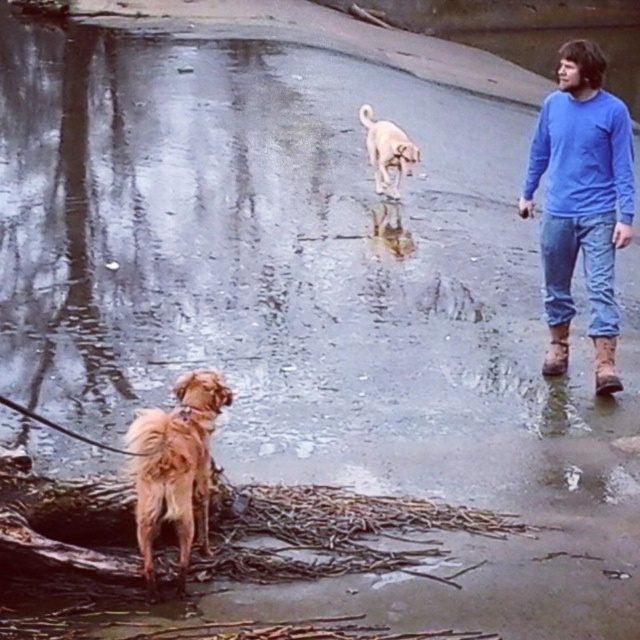
Question: Does blue cotton sweatshirt at right appear over golden fur dog at upper center?

Choices:
 (A) yes
 (B) no

Answer: (B)

Question: Is blue cotton shirt at right in front of blue cotton sweatshirt at right?

Choices:
 (A) no
 (B) yes

Answer: (B)

Question: Which point is farther from the camera taking this photo?

Choices:
 (A) (152, 412)
 (B) (397, 134)
 (C) (554, 284)
 (D) (556, 104)

Answer: (B)

Question: Considering the real-world distances, which object is farthest from the golden fur dog at upper center?

Choices:
 (A) blue cotton sweatshirt at right
 (B) blue cotton shirt at right
 (C) golden fur dog at lower left

Answer: (C)

Question: Which object is positioned farthest from the blue cotton shirt at right?

Choices:
 (A) golden fur dog at upper center
 (B) golden fur dog at lower left

Answer: (A)

Question: Considering the relative positions of golden fur dog at lower left and golden fur dog at upper center in the image provided, where is golden fur dog at lower left located with respect to golden fur dog at upper center?

Choices:
 (A) left
 (B) right

Answer: (A)